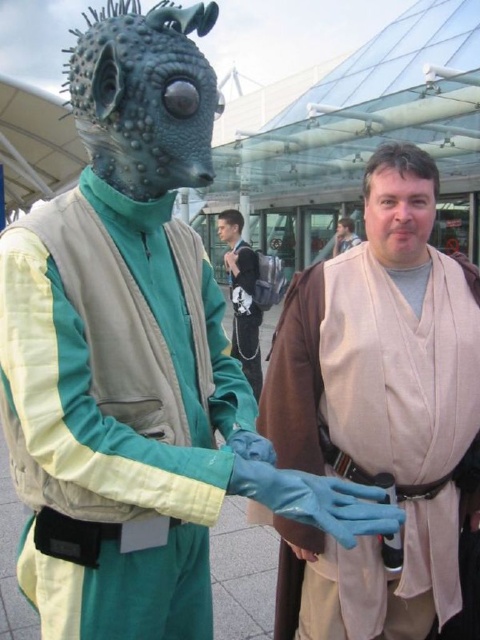
You are a photographer at a convention and need to capture a photo of both the beige fabric robe at center and the green matte vest at center in the same frame. The camera you are using has a maximum focus range of 20 inches. Can you fit both subjects within the camera focus range without moving the camera?

The distance between the beige fabric robe at center and the green matte vest at center is 23.64 inches, which exceeds the camera focus range of 20 inches. Therefore, you cannot fit both subjects within the camera focus range without moving the camera.

You are a photographer setting up for a group photo at a convention. You have two subjects wearing the beige fabric robe at center and the light brown leather jacket at center. The minimum distance required between subjects for your camera lens to focus properly is 10 feet. Can both subjects be positioned at their current distance apart and still be in focus?

The beige fabric robe at center is 10.70 feet from the light brown leather jacket at center. Since 10.70 feet is greater than the minimum required 10 feet, both subjects can be positioned at their current distance apart and still be in focus.

You are a costume designer trying to determine which costume piece is wider for a scene where both characters need to stand side by side. Based on the image, which object is wider between the green matte vest at center and the light brown leather jacket at center?

The green matte vest at center is wider than the light brown leather jacket at center according to the description.